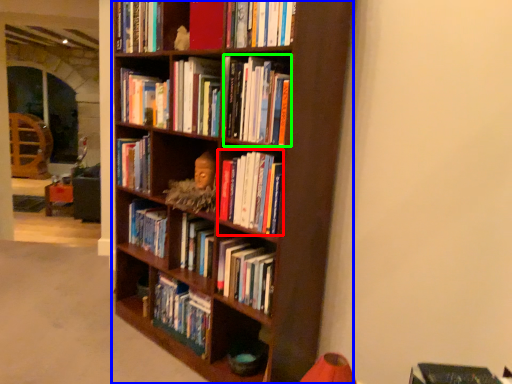
Question: Which object is the closest to the book (highlighted by a red box)? Choose among these: bookcase (highlighted by a blue box) or book (highlighted by a green box).

Choices:
 (A) bookcase
 (B) book

Answer: (B)